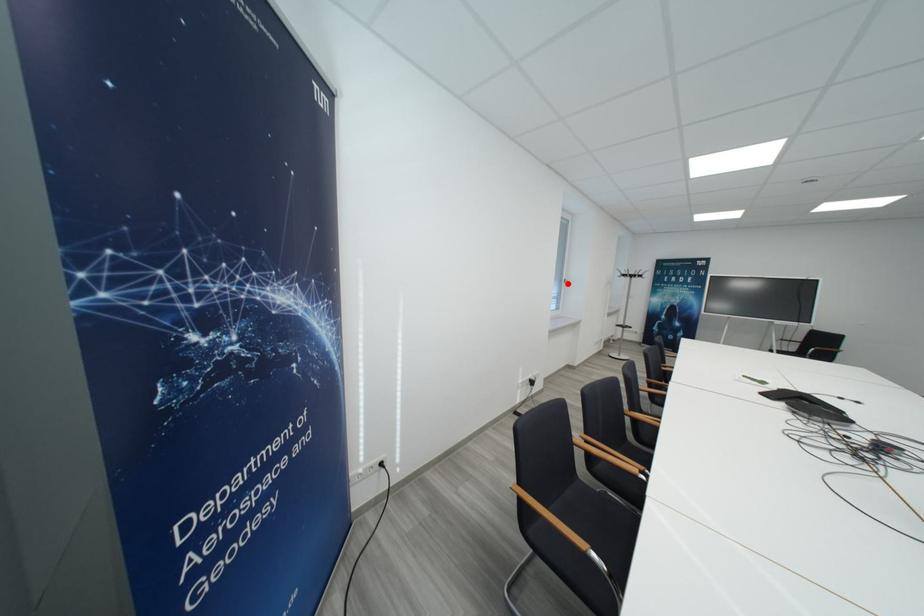
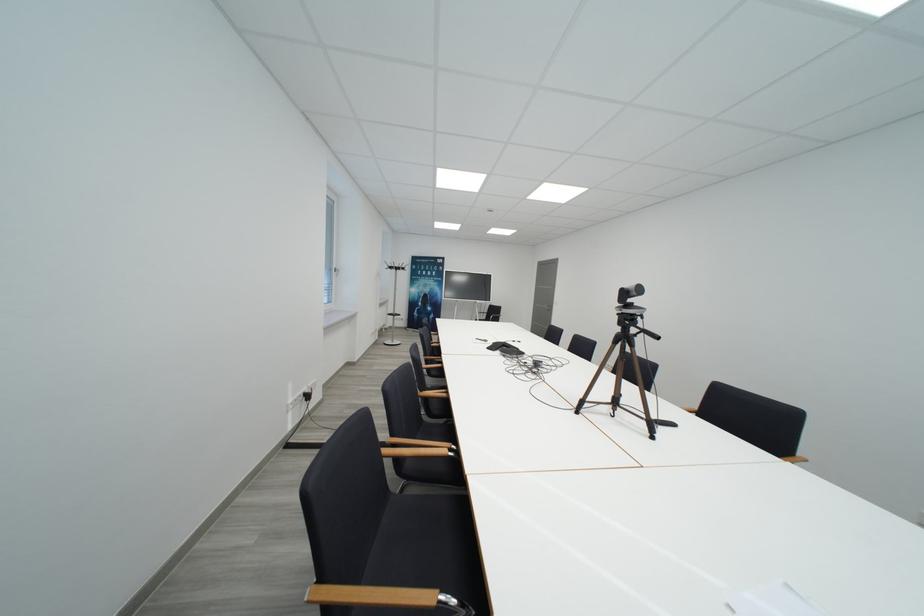
The point at the highlighted location is marked in the first image. Where is the corresponding point in the second image?

(337, 273)